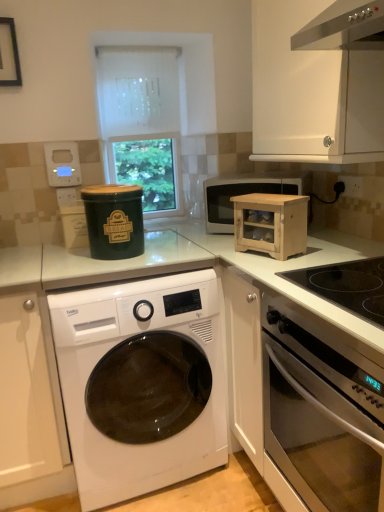
Measure the distance between white matte cabinet at lower left, which appears as the 1th cabinetry when ordered from the bottom, and camera.

The depth of white matte cabinet at lower left, which appears as the 1th cabinetry when ordered from the bottom, is 4.64 feet.

The width and height of the screenshot is (384, 512). In order to click on black matte picture frame at upper left in this screenshot , I will do `click(9, 54)`.

This screenshot has width=384, height=512. What do you see at coordinates (318, 81) in the screenshot? I see `white matte cabinet at upper right, the 1th cabinetry in the top-to-bottom sequence` at bounding box center [318, 81].

The height and width of the screenshot is (512, 384). What do you see at coordinates (271, 224) in the screenshot?
I see `natural wood cabinet at right` at bounding box center [271, 224].

Image resolution: width=384 pixels, height=512 pixels. I want to click on matte black microwave at center, so click(244, 193).

What do you see at coordinates (244, 193) in the screenshot?
I see `matte black microwave at center` at bounding box center [244, 193].

What is the approximate width of white textured roller blind at upper center?

The width of white textured roller blind at upper center is 3.76 inches.

You are a GUI agent. You are given a task and a screenshot of the screen. Output one action in this format:
    pyautogui.click(x=<x>, y=<y>)
    Task: Click on the green matte canister at center, the second appliance from the left
    Image resolution: width=384 pixels, height=512 pixels.
    Given the screenshot: What is the action you would take?
    point(114,220)

Does point (6, 61) come closer to viewer compared to point (69, 193)?

Yes, point (6, 61) is in front of point (69, 193).

Could white plastic electrical outlet at left, positioned as the first electric outlet in left-to-right order, be considered to be inside black matte picture frame at upper left?

Actually, white plastic electrical outlet at left, positioned as the first electric outlet in left-to-right order, is outside black matte picture frame at upper left.

Considering the relative sizes of black matte picture frame at upper left and white plastic electrical outlet at left, the second electric outlet in the front-to-back sequence, in the image provided, is black matte picture frame at upper left taller than white plastic electrical outlet at left, the second electric outlet in the front-to-back sequence,?

Indeed, black matte picture frame at upper left has a greater height compared to white plastic electrical outlet at left, the second electric outlet in the front-to-back sequence.

Considering the relative sizes of black matte picture frame at upper left and white plastic electrical outlet at left, the second electric outlet in the front-to-back sequence, in the image provided, is black matte picture frame at upper left smaller than white plastic electrical outlet at left, the second electric outlet in the front-to-back sequence,?

Actually, black matte picture frame at upper left might be larger than white plastic electrical outlet at left, the second electric outlet in the front-to-back sequence.

From a real-world perspective, which is physically above, white plastic thermostat at upper left, which is the 1th appliance from left to right, or matte black microwave at center?

white plastic thermostat at upper left, which is the 1th appliance from left to right.

Is white plastic thermostat at upper left, which ranks as the second appliance in right-to-left order, taller or shorter than matte black microwave at center?

In the image, white plastic thermostat at upper left, which ranks as the second appliance in right-to-left order, appears to be shorter than matte black microwave at center.

Considering the positions of objects white plastic thermostat at upper left, the 2th appliance positioned from the front, and matte black microwave at center in the image provided, who is more to the right, white plastic thermostat at upper left, the 2th appliance positioned from the front, or matte black microwave at center?

matte black microwave at center is more to the right.

From the image's perspective, is white plastic thermostat at upper left, the 2th appliance ordered from the bottom, on matte black microwave at center?

Yes, from the image's perspective, white plastic thermostat at upper left, the 2th appliance ordered from the bottom, is above matte black microwave at center.

From a real-world perspective, does white plastic thermostat at upper left, the 2th appliance positioned from the front, sit lower than satin silver oven at lower right?

Incorrect, from a real-world perspective, white plastic thermostat at upper left, the 2th appliance positioned from the front, is higher than satin silver oven at lower right.

Would you say white plastic thermostat at upper left, the 2th appliance positioned from the front, is to the left or to the right of satin silver oven at lower right in the picture?

white plastic thermostat at upper left, the 2th appliance positioned from the front, is to the left of satin silver oven at lower right.

Is white plastic thermostat at upper left, the 2th appliance ordered from the bottom, aimed at satin silver oven at lower right?

No, white plastic thermostat at upper left, the 2th appliance ordered from the bottom, is not facing towards satin silver oven at lower right.

Is white plastic thermostat at upper left, which appears as the 1th appliance when viewed from the top, outside of satin silver oven at lower right?

Yes, white plastic thermostat at upper left, which appears as the 1th appliance when viewed from the top, is outside of satin silver oven at lower right.

In the scene shown: Considering the relative sizes of satin silver oven at lower right and black matte picture frame at upper left in the image provided, is satin silver oven at lower right smaller than black matte picture frame at upper left?

Actually, satin silver oven at lower right might be larger than black matte picture frame at upper left.

From the picture: Which point is more forward, [324,425] or [2,66]?

The point [324,425] is more forward.

What's the angular difference between satin silver oven at lower right and black matte picture frame at upper left's facing directions?

There is a 93.6-degree angle between the facing directions of satin silver oven at lower right and black matte picture frame at upper left.

You are a GUI agent. You are given a task and a screenshot of the screen. Output one action in this format:
    pyautogui.click(x=<x>, y=<y>)
    Task: Click on the picture frame that is behind the satin silver oven at lower right
    The height and width of the screenshot is (512, 384).
    Given the screenshot: What is the action you would take?
    pyautogui.click(x=9, y=54)

Choose the correct answer: Is white textured roller blind at upper center inside black plastic electric outlet at upper right, arranged as the second electric outlet when viewed from the back, or outside it?

white textured roller blind at upper center is spatially situated outside black plastic electric outlet at upper right, arranged as the second electric outlet when viewed from the back.

From the image's perspective, is white textured roller blind at upper center over black plastic electric outlet at upper right, arranged as the second electric outlet when viewed from the back?

Yes, from the image's perspective, white textured roller blind at upper center is on top of black plastic electric outlet at upper right, arranged as the second electric outlet when viewed from the back.

Can you confirm if white textured roller blind at upper center is smaller than black plastic electric outlet at upper right, positioned as the first electric outlet in right-to-left order?

No, white textured roller blind at upper center is not smaller than black plastic electric outlet at upper right, positioned as the first electric outlet in right-to-left order.

In the scene shown: Is white matte cabinet at lower left, the 2th cabinetry when ordered from right to left, spatially inside white matte cabinet at upper right, the first cabinetry from the right, or outside of it?

white matte cabinet at lower left, the 2th cabinetry when ordered from right to left, is located beyond the bounds of white matte cabinet at upper right, the first cabinetry from the right.

Could you tell me if white matte cabinet at lower left, which ranks as the second cabinetry in top-to-bottom order, is facing white matte cabinet at upper right, the 1th cabinetry in the top-to-bottom sequence?

No, white matte cabinet at lower left, which ranks as the second cabinetry in top-to-bottom order, is not facing towards white matte cabinet at upper right, the 1th cabinetry in the top-to-bottom sequence.

Considering the sizes of objects white matte cabinet at lower left, which ranks as the second cabinetry in top-to-bottom order, and white matte cabinet at upper right, the first cabinetry from the right, in the image provided, who is bigger, white matte cabinet at lower left, which ranks as the second cabinetry in top-to-bottom order, or white matte cabinet at upper right, the first cabinetry from the right,?

Bigger between the two is white matte cabinet at lower left, which ranks as the second cabinetry in top-to-bottom order.

Can you confirm if white matte cabinet at lower left, which appears as the 1th cabinetry when ordered from the bottom, is positioned to the left of white matte cabinet at upper right, the first cabinetry from the right?

Correct, you'll find white matte cabinet at lower left, which appears as the 1th cabinetry when ordered from the bottom, to the left of white matte cabinet at upper right, the first cabinetry from the right.

Which object is closer to the camera, white matte cabinet at upper right, the first cabinetry from the right, or white matte cabinet at lower left, which is the 1th cabinetry from left to right?

Positioned in front is white matte cabinet at upper right, the first cabinetry from the right.

Is white matte cabinet at lower left, which is the 1th cabinetry from left to right, at the back of white matte cabinet at upper right, acting as the second cabinetry starting from the bottom?

No.

Is white matte cabinet at lower left, which ranks as the second cabinetry in top-to-bottom order, inside white matte cabinet at upper right, the first cabinetry from the right?

No, white matte cabinet at lower left, which ranks as the second cabinetry in top-to-bottom order, is located outside of white matte cabinet at upper right, the first cabinetry from the right.

Where is `electric outlet that is the 2nd one when counting backward from the black matte picture frame at upper left`? electric outlet that is the 2nd one when counting backward from the black matte picture frame at upper left is located at coordinates (66, 196).

Where is `microwave oven that is below the white plastic thermostat at upper left, which ranks as the second appliance in right-to-left order (from the image's perspective)`? The width and height of the screenshot is (384, 512). microwave oven that is below the white plastic thermostat at upper left, which ranks as the second appliance in right-to-left order (from the image's perspective) is located at coordinates (244, 193).

From the picture: From the image, which object appears to be nearer to white matte cabinet at lower left, which ranks as the second cabinetry in top-to-bottom order, black glass cooktop at right or white matte cabinet at upper right, acting as the second cabinetry starting from the bottom?

black glass cooktop at right is closer to white matte cabinet at lower left, which ranks as the second cabinetry in top-to-bottom order.

From the image, which object appears to be farther from natural wood cabinet at right, white glossy washing machine at center or white matte cabinet at lower left, the 2th cabinetry when ordered from right to left?

The object further to natural wood cabinet at right is white matte cabinet at lower left, the 2th cabinetry when ordered from right to left.

Based on the photo, which object lies further to the anchor point white plastic electrical outlet at left, positioned as the first electric outlet in left-to-right order, white glossy washing machine at center or white textured roller blind at upper center?

Among the two, white glossy washing machine at center is located further to white plastic electrical outlet at left, positioned as the first electric outlet in left-to-right order.

From the image, which object appears to be farther from black glass cooktop at right, black plastic electric outlet at upper right, positioned as the first electric outlet in right-to-left order, or black matte picture frame at upper left?

The object further to black glass cooktop at right is black matte picture frame at upper left.

When comparing their distances from white plastic thermostat at upper left, which ranks as the second appliance in right-to-left order, does black matte picture frame at upper left or natural wood cabinet at right seem further?

Among the two, natural wood cabinet at right is located further to white plastic thermostat at upper left, which ranks as the second appliance in right-to-left order.

Looking at the image, which one is located further to black matte picture frame at upper left, white matte cabinet at upper right, acting as the second cabinetry starting from the bottom, or white plastic electrical outlet at left, which appears as the first electric outlet when viewed from the back?

The object further to black matte picture frame at upper left is white matte cabinet at upper right, acting as the second cabinetry starting from the bottom.

Based on their spatial positions, is black matte picture frame at upper left or matte black microwave at center further from white plastic electrical outlet at left, which appears as the first electric outlet when viewed from the back?

Among the two, matte black microwave at center is located further to white plastic electrical outlet at left, which appears as the first electric outlet when viewed from the back.

When comparing their distances from black plastic electric outlet at upper right, placed as the 2th electric outlet when sorted from left to right, does green matte canister at center, placed as the 2th appliance when sorted from back to front, or white matte cabinet at upper right, acting as the second cabinetry starting from the bottom, seem closer?

Among the two, white matte cabinet at upper right, acting as the second cabinetry starting from the bottom, is located nearer to black plastic electric outlet at upper right, placed as the 2th electric outlet when sorted from left to right.

This screenshot has height=512, width=384. Identify the location of microwave oven between white textured roller blind at upper center and white matte cabinet at lower left, which is the 1th cabinetry from left to right, from top to bottom. (244, 193).

At what (x,y) coordinates should I click in order to perform the action: click on washing machine between white plastic electrical outlet at left, the second electric outlet in the front-to-back sequence, and black plastic electric outlet at upper right, which is counted as the first electric outlet, starting from the front, in the horizontal direction. Please return your answer as a coordinate pair (x, y). The image size is (384, 512). Looking at the image, I should click on (141, 383).

The image size is (384, 512). I want to click on washing machine between black glass cooktop at right and white textured roller blind at upper center along the z-axis, so click(x=141, y=383).

At what (x,y) coordinates should I click in order to perform the action: click on cardboard box between white plastic electrical outlet at left, positioned as the first electric outlet in left-to-right order, and white matte cabinet at upper right, positioned as the 2th cabinetry in left-to-right order, from left to right. Please return your answer as a coordinate pair (x, y). This screenshot has width=384, height=512. Looking at the image, I should click on (271, 224).